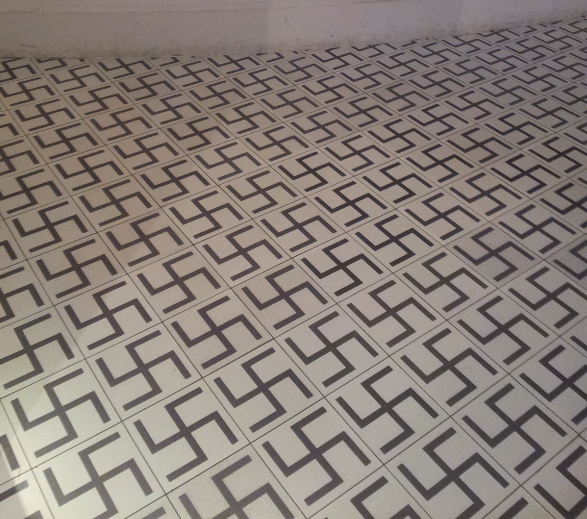
This screenshot has width=587, height=519. Identify the location of tile. (553, 200).